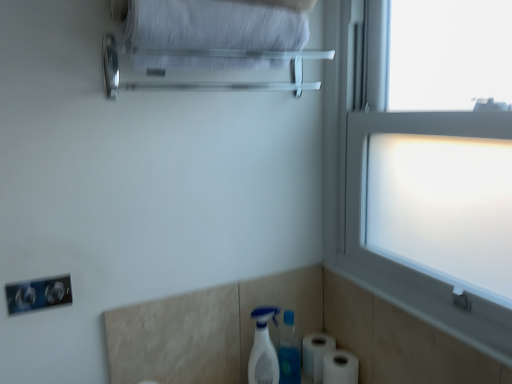
Question: Does frosted glass window at right come behind white matte toilet paper at lower right, the first toilet paper when ordered from front to back?

Choices:
 (A) yes
 (B) no

Answer: (B)

Question: From the image's perspective, would you say frosted glass window at right is shown under white matte toilet paper at lower right, the first toilet paper when ordered from front to back?

Choices:
 (A) yes
 (B) no

Answer: (B)

Question: Does frosted glass window at right have a lesser height compared to white matte toilet paper at lower right, the first toilet paper when ordered from front to back?

Choices:
 (A) yes
 (B) no

Answer: (B)

Question: Is frosted glass window at right at the right side of white matte toilet paper at lower right, the first toilet paper when ordered from front to back?

Choices:
 (A) no
 (B) yes

Answer: (B)

Question: Is frosted glass window at right not close to white matte toilet paper at lower right, the first toilet paper when ordered from front to back?

Choices:
 (A) yes
 (B) no

Answer: (B)

Question: Is white fabric bath towel at upper center taller or shorter than white matte toilet paper at lower right, the first toilet paper when ordered from front to back?

Choices:
 (A) short
 (B) tall

Answer: (B)

Question: Based on their sizes in the image, would you say white fabric bath towel at upper center is bigger or smaller than white matte toilet paper at lower right, the first toilet paper when ordered from front to back?

Choices:
 (A) big
 (B) small

Answer: (A)

Question: From a real-world perspective, is white fabric bath towel at upper center above or below white matte toilet paper at lower right, which appears as the second toilet paper when viewed from the back?

Choices:
 (A) below
 (B) above

Answer: (B)

Question: Considering the positions of white fabric bath towel at upper center and white matte toilet paper at lower right, which appears as the second toilet paper when viewed from the back, in the image, is white fabric bath towel at upper center wider or thinner than white matte toilet paper at lower right, which appears as the second toilet paper when viewed from the back,?

Choices:
 (A) thin
 (B) wide

Answer: (B)

Question: From the image's perspective, is frosted glass window at right above or below white plastic spray bottle at lower center?

Choices:
 (A) above
 (B) below

Answer: (A)

Question: Is point (485, 324) closer or farther from the camera than point (259, 317)?

Choices:
 (A) closer
 (B) farther

Answer: (A)

Question: Which is correct: frosted glass window at right is inside white plastic spray bottle at lower center, or outside of it?

Choices:
 (A) inside
 (B) outside

Answer: (B)

Question: In terms of height, does frosted glass window at right look taller or shorter compared to white plastic spray bottle at lower center?

Choices:
 (A) tall
 (B) short

Answer: (A)

Question: Is white matte toilet paper at lower right, the 1th toilet paper viewed from the back, bigger or smaller than white plastic spray bottle at lower center?

Choices:
 (A) big
 (B) small

Answer: (B)

Question: From a real-world perspective, is white matte toilet paper at lower right, positioned as the 2th toilet paper in front-to-back order, physically located above or below white plastic spray bottle at lower center?

Choices:
 (A) below
 (B) above

Answer: (A)